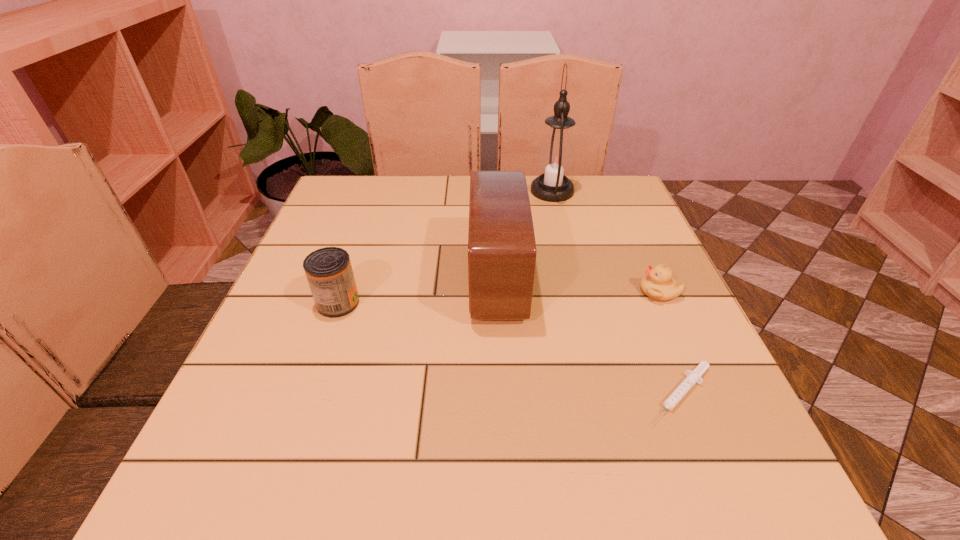
Locate an element on the screen. This screenshot has height=540, width=960. vacant space located on the front-facing side of the fourth object from right to left is located at coordinates (448, 279).

The height and width of the screenshot is (540, 960). I want to click on vacant space situated on the front-facing side of the fourth object from right to left, so click(426, 279).

The image size is (960, 540). In order to click on free space located on the front-facing side of the fourth object from right to left in this screenshot , I will do `click(421, 279)`.

At what (x,y) coordinates should I click in order to perform the action: click on vacant space located on the back of the leftmost object. Please return your answer as a coordinate pair (x, y). Image resolution: width=960 pixels, height=540 pixels. Looking at the image, I should click on (375, 194).

Locate an element on the screen. vacant space located 0.180m on the beak of the fourth tallest object is located at coordinates (557, 292).

Locate an element on the screen. free point located on the beak of the fourth tallest object is located at coordinates (x=501, y=292).

Where is `vacant space situated on the beak of the fourth tallest object`? The height and width of the screenshot is (540, 960). vacant space situated on the beak of the fourth tallest object is located at coordinates (608, 292).

Where is `vacant region located on the left of the nearest object`? Image resolution: width=960 pixels, height=540 pixels. vacant region located on the left of the nearest object is located at coordinates (524, 394).

Find the location of `object that is at the far edge`. object that is at the far edge is located at coordinates (556, 158).

You are a GUI agent. You are given a task and a screenshot of the screen. Output one action in this format:
    pyautogui.click(x=<x>, y=<y>)
    Task: Click on the object that is at the left edge
    This screenshot has height=540, width=960.
    Given the screenshot: What is the action you would take?
    pyautogui.click(x=329, y=273)